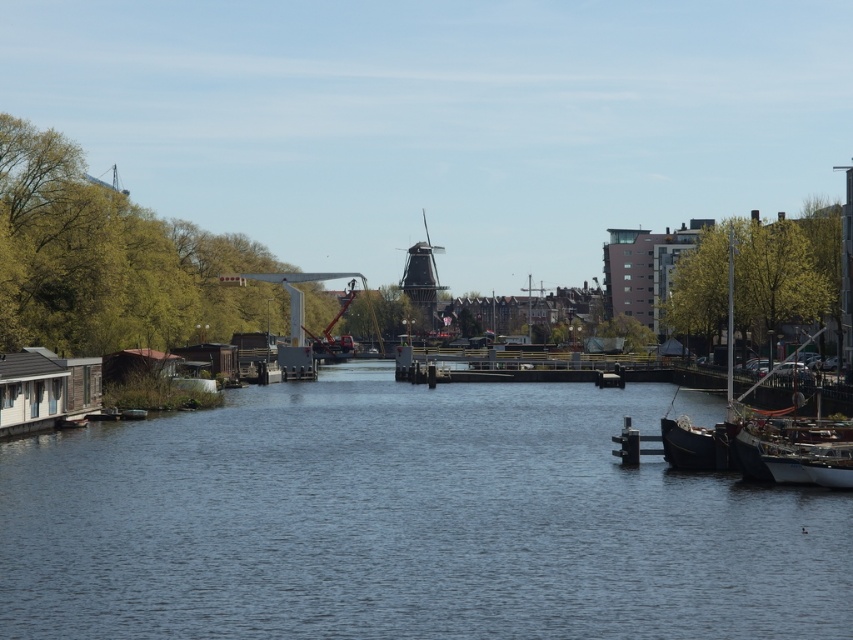
You are standing on the left bank of the canal and want to board the dark brown wooden boat at right. Based on the scene, can you determine if the blue water at center is between you and the boat?

The blue water at center is located below the dark brown wooden boat at right, which means the boat is positioned above the water. Since you are on the left bank, the blue water at center would be between you and the boat as you approach it along the canal.

Based on the photo, you are standing on the left bank of the canal and want to cross to the right side. There is a blue water at center and a dark brown wooden boat at right. Which object is closer to you as you stand on the left bank?

The blue water at center is closer to you because it is in front of the dark brown wooden boat at right, meaning the boat is further away from the left bank.